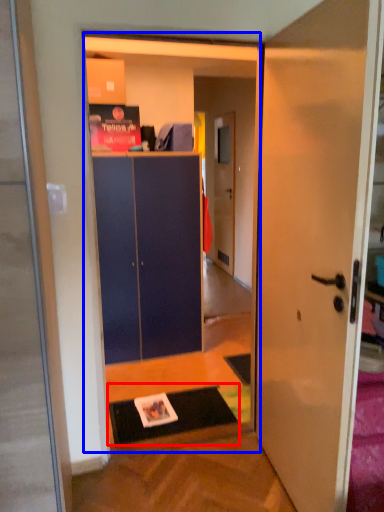
Question: Which point is further to the camera, doormat (highlighted by a red box) or bookstore (highlighted by a blue box)?

Choices:
 (A) doormat
 (B) bookstore

Answer: (A)